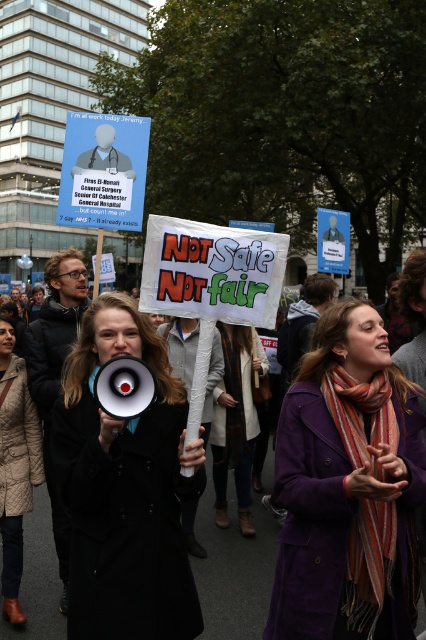
Question: Is black matte coat at center smaller than black fabric coat at center?

Choices:
 (A) no
 (B) yes

Answer: (A)

Question: Does black fabric coat at center come behind quilted beige coat at center?

Choices:
 (A) no
 (B) yes

Answer: (A)

Question: Based on their relative distances, which object is farther from the knitted wool scarf at center?

Choices:
 (A) purple woolen coat at center
 (B) quilted beige coat at center
 (C) black fabric coat at center

Answer: (A)

Question: Which point is closer to the camera taking this photo?

Choices:
 (A) (23, 509)
 (B) (236, 540)
 (C) (244, 401)
 (D) (331, 492)

Answer: (D)

Question: Which point is farther to the camera?

Choices:
 (A) black matte coat at center
 (B) black fabric coat at center

Answer: (B)

Question: Can you confirm if black fabric coat at center is positioned to the right of knitted wool scarf at center?

Choices:
 (A) no
 (B) yes

Answer: (B)